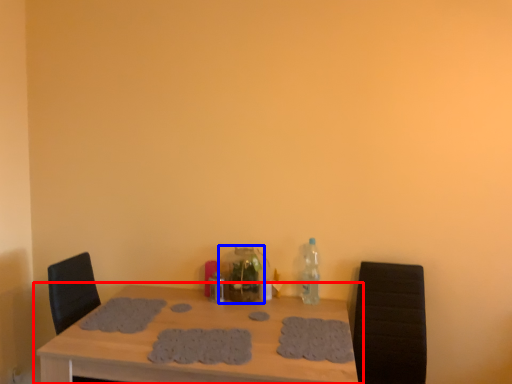
Question: Among these objects, which one is farthest to the camera, table (highlighted by a red box) or bottle (highlighted by a blue box)?

Choices:
 (A) table
 (B) bottle

Answer: (B)